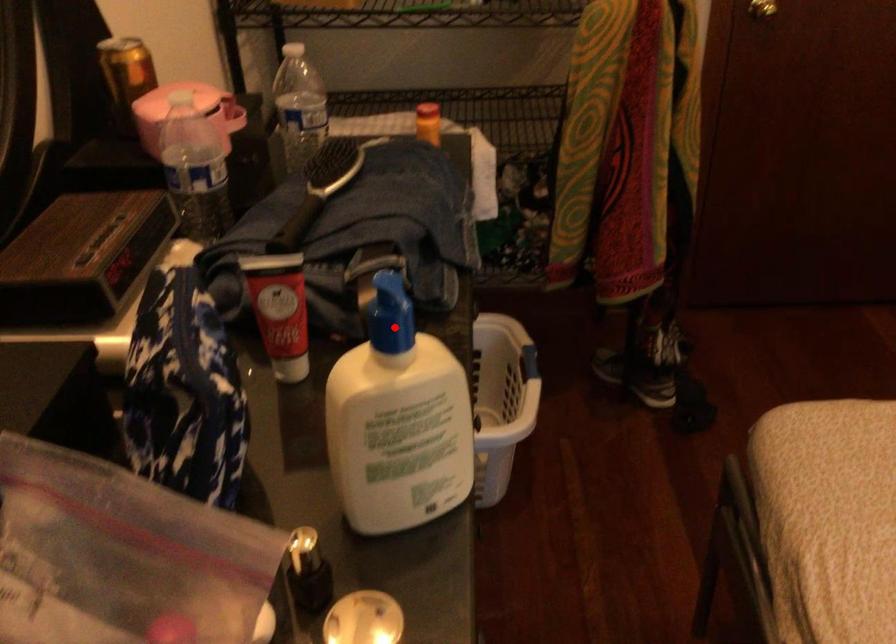
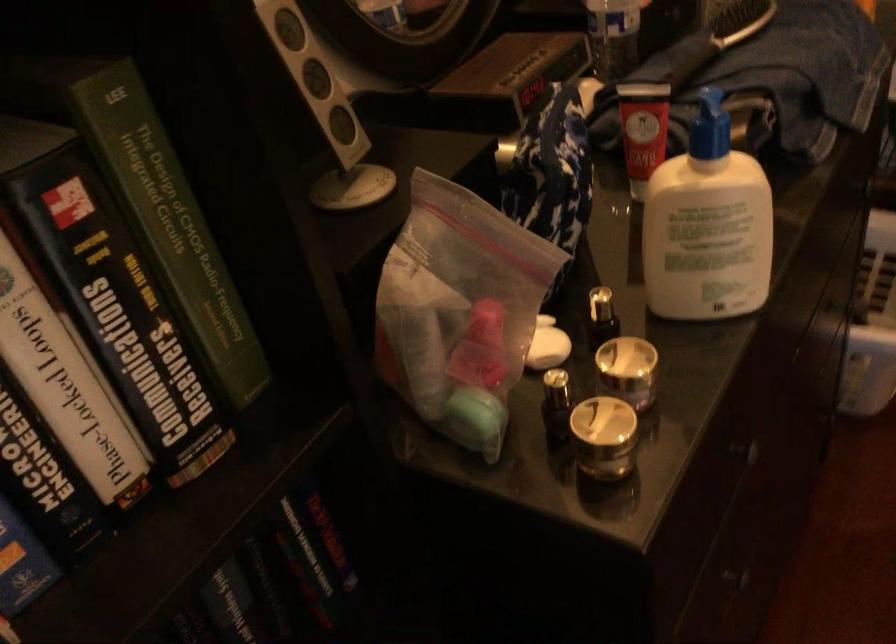
Question: I am providing you with two images of the same scene from different viewpoints. Image1 has a red point marked. In image2, the corresponding 3D location appears at what relative position? Reply with the corresponding letter.

Choices:
 (A) Closer
 (B) Farther

Answer: (B)